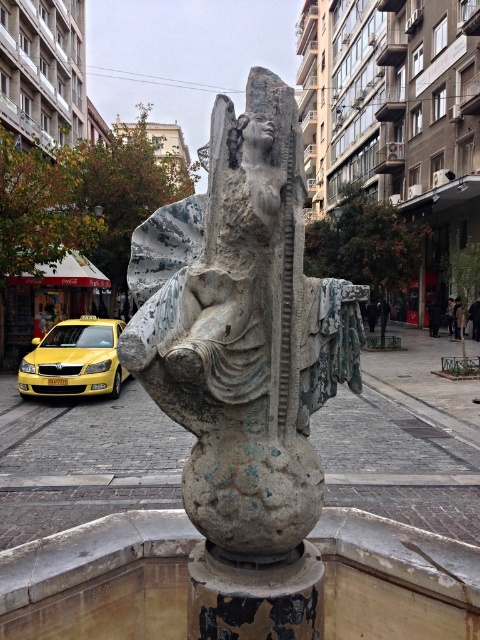
Question: Observing the image, what is the correct spatial positioning of green patina stone sculpture at center in reference to yellow metallic taxi at left?

Choices:
 (A) left
 (B) right

Answer: (B)

Question: Can you confirm if green patina stone sculpture at center is smaller than yellow metallic taxi at left?

Choices:
 (A) no
 (B) yes

Answer: (B)

Question: Estimate the real-world distances between objects in this image. Which object is farther from the green patina stone sculpture at center?

Choices:
 (A) rusty metallic pillar at center
 (B) yellow metallic taxi at left

Answer: (B)

Question: Which point is closer to the camera?

Choices:
 (A) (84, 346)
 (B) (295, 440)

Answer: (B)

Question: Estimate the real-world distances between objects in this image. Which object is farther from the green patina stone sculpture at center?

Choices:
 (A) rusty metallic pillar at center
 (B) yellow metallic taxi at left

Answer: (B)

Question: Is green patina stone sculpture at center bigger than yellow metallic taxi at left?

Choices:
 (A) yes
 (B) no

Answer: (B)